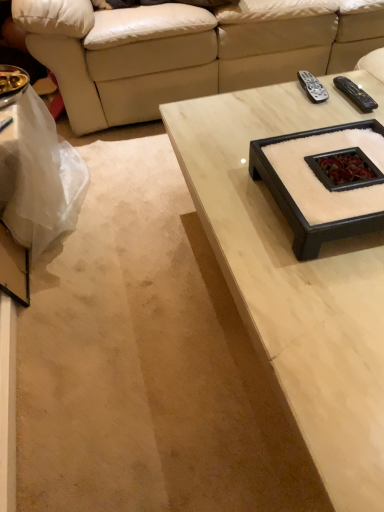
You are a GUI agent. You are given a task and a screenshot of the screen. Output one action in this format:
    pyautogui.click(x=<x>, y=<y>)
    Task: Click on the vacant area in front of black plastic remote at upper right, arranged as the second remote when viewed from the right
    
    Given the screenshot: What is the action you would take?
    pyautogui.click(x=309, y=115)